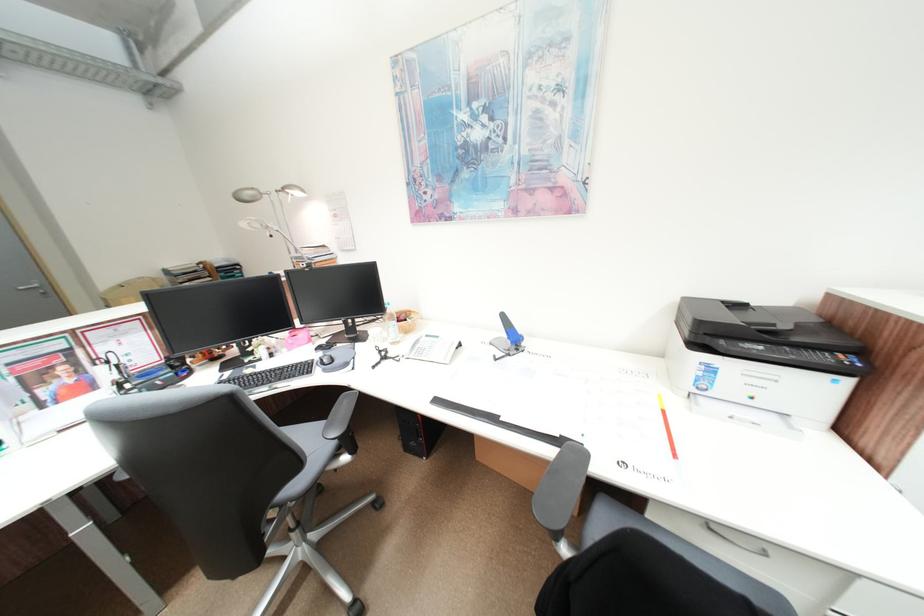
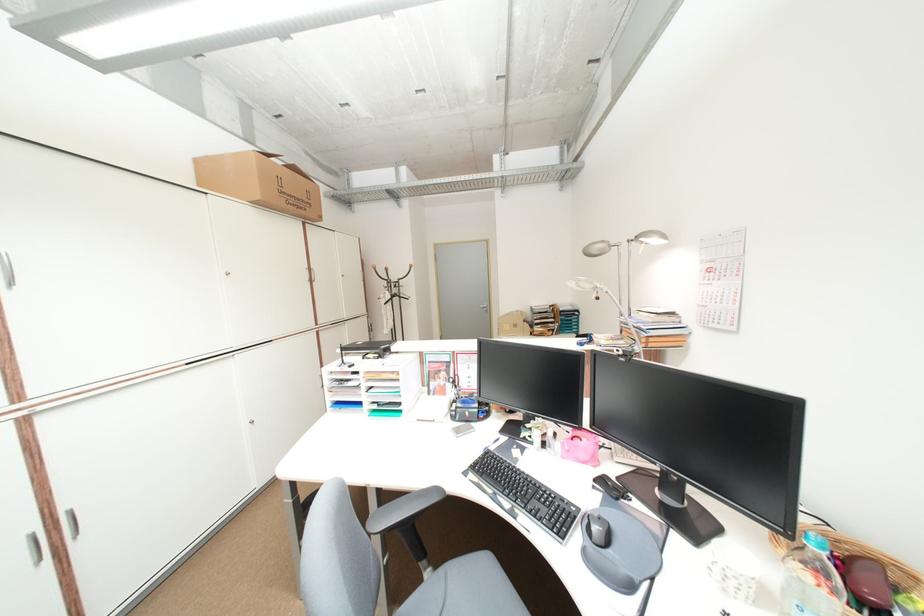
Question: The camera is either moving clockwise (left) or counter-clockwise (right) around the object. The first image is from the beginning of the video and the second image is from the end. Is the camera moving left or right when shooting the video?

Choices:
 (A) Left
 (B) Right

Answer: (B)